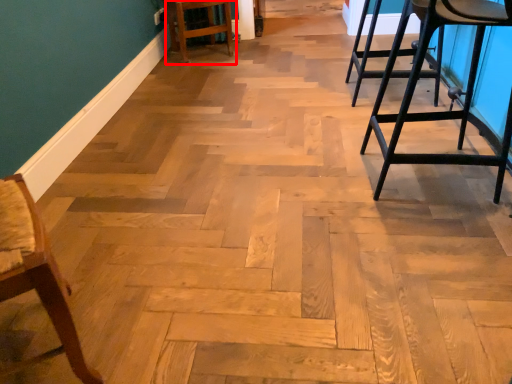
Question: From the image's perspective, what is the correct spatial relationship of bar stool (annotated by the red box) in relation to chair?

Choices:
 (A) above
 (B) below

Answer: (A)